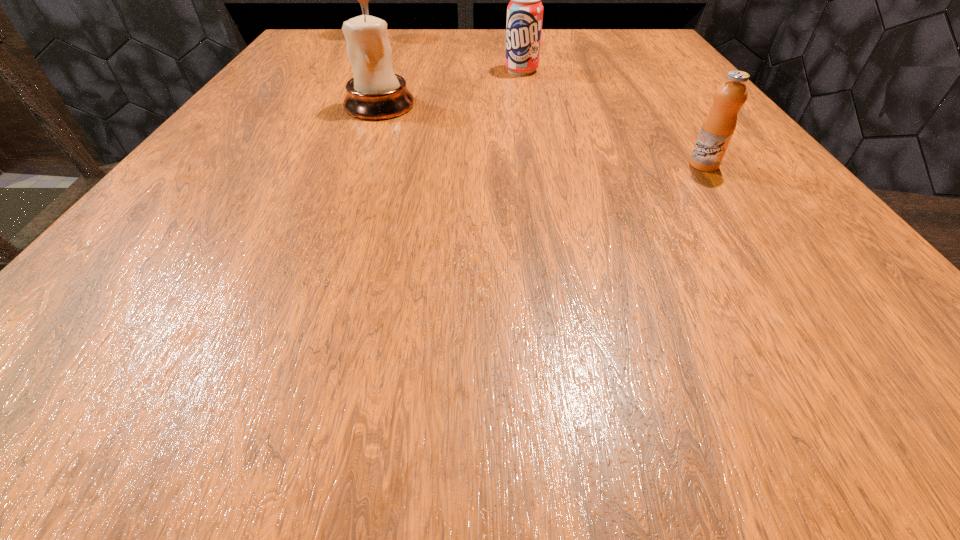
The image size is (960, 540). I want to click on wineglass located in the far edge section of the desktop, so click(363, 0).

The height and width of the screenshot is (540, 960). In order to click on soda can positioned at the far edge in this screenshot , I will do `click(525, 10)`.

This screenshot has height=540, width=960. I want to click on object that is at the left edge, so click(363, 0).

Find the location of a particular element. object situated at the right edge is located at coordinates (718, 127).

At what (x,y) coordinates should I click in order to perform the action: click on object located at the far left corner. Please return your answer as a coordinate pair (x, y). Looking at the image, I should click on (363, 0).

The image size is (960, 540). In the image, there is a desktop. Find the location of `vacant space at the far edge`. vacant space at the far edge is located at coordinates (559, 39).

Find the location of `free region at the near edge`. free region at the near edge is located at coordinates (597, 331).

The image size is (960, 540). Find the location of `free space at the left edge of the desktop`. free space at the left edge of the desktop is located at coordinates (293, 157).

Find the location of a particular element. The height and width of the screenshot is (540, 960). free region at the right edge of the desktop is located at coordinates (852, 296).

You are a GUI agent. You are given a task and a screenshot of the screen. Output one action in this format:
    pyautogui.click(x=<x>, y=<y>)
    Task: Click on the free region at the far left corner of the desktop
    Image resolution: width=960 pixels, height=540 pixels.
    Given the screenshot: What is the action you would take?
    pyautogui.click(x=324, y=30)